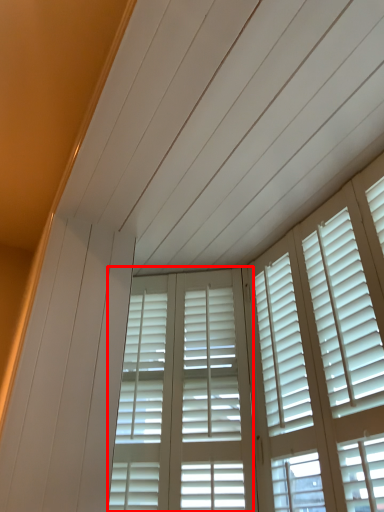
Question: Where is screen door (annotated by the red box) located in relation to window in the image?

Choices:
 (A) left
 (B) right

Answer: (B)